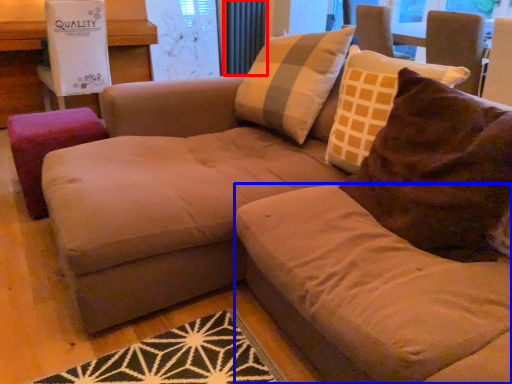
Question: Which point is closer to the camera, radiator (highlighted by a red box) or beige (highlighted by a blue box)?

Choices:
 (A) radiator
 (B) beige

Answer: (B)